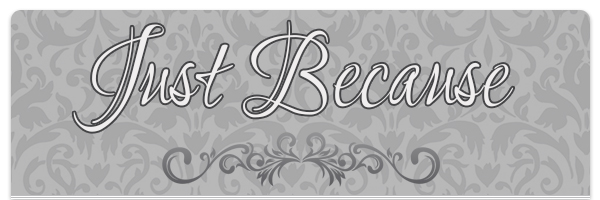
You are a GUI agent. You are given a task and a screenshot of the screen. Output one action in this format:
    pyautogui.click(x=<x>, y=<y>)
    Task: Click on the darker gray decorative graphics
    The image size is (600, 200).
    Given the screenshot: What is the action you would take?
    pyautogui.click(x=113, y=131)